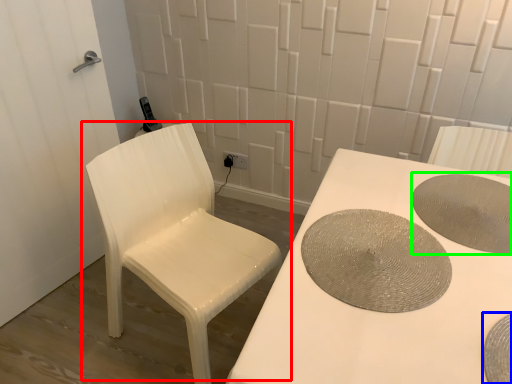
Question: Based on their relative distances, which object is farther from chair (highlighted by a red box)? Choose from manhole cover (highlighted by a blue box) and manhole cover (highlighted by a green box).

Choices:
 (A) manhole cover
 (B) manhole cover

Answer: (A)